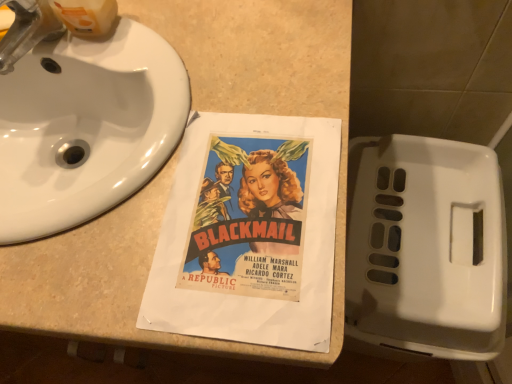
Question: Is beige laminate counter at center thinner than brushed metal faucet at upper left?

Choices:
 (A) no
 (B) yes

Answer: (A)

Question: Is brushed metal faucet at upper left inside beige laminate counter at center?

Choices:
 (A) yes
 (B) no

Answer: (B)

Question: From a real-world perspective, is beige laminate counter at center below brushed metal faucet at upper left?

Choices:
 (A) no
 (B) yes

Answer: (B)

Question: Is beige laminate counter at center next to brushed metal faucet at upper left and touching it?

Choices:
 (A) no
 (B) yes

Answer: (A)

Question: Does beige laminate counter at center have a greater width compared to brushed metal faucet at upper left?

Choices:
 (A) no
 (B) yes

Answer: (B)

Question: Do you think white plastic toilet at lower right is within beige laminate counter at center, or outside of it?

Choices:
 (A) outside
 (B) inside

Answer: (A)

Question: From a real-world perspective, is white plastic toilet at lower right physically located above or below beige laminate counter at center?

Choices:
 (A) below
 (B) above

Answer: (A)

Question: Is white plastic toilet at lower right in front of or behind beige laminate counter at center in the image?

Choices:
 (A) behind
 (B) front

Answer: (A)

Question: From the image's perspective, is white plastic toilet at lower right above or below beige laminate counter at center?

Choices:
 (A) above
 (B) below

Answer: (B)

Question: Choose the correct answer: Is white glossy sink at upper left inside beige laminate counter at center or outside it?

Choices:
 (A) outside
 (B) inside

Answer: (B)

Question: From a real-world perspective, is white glossy sink at upper left positioned above or below beige laminate counter at center?

Choices:
 (A) below
 (B) above

Answer: (B)

Question: Considering the relative positions of white glossy sink at upper left and beige laminate counter at center in the image provided, is white glossy sink at upper left to the left or to the right of beige laminate counter at center?

Choices:
 (A) left
 (B) right

Answer: (B)

Question: Is white glossy sink at upper left wider or thinner than beige laminate counter at center?

Choices:
 (A) wide
 (B) thin

Answer: (B)

Question: Does point (9, 54) appear closer or farther from the camera than point (119, 61)?

Choices:
 (A) closer
 (B) farther

Answer: (A)

Question: From a real-world perspective, is brushed metal faucet at upper left positioned above or below white glossy sink at upper left?

Choices:
 (A) above
 (B) below

Answer: (A)